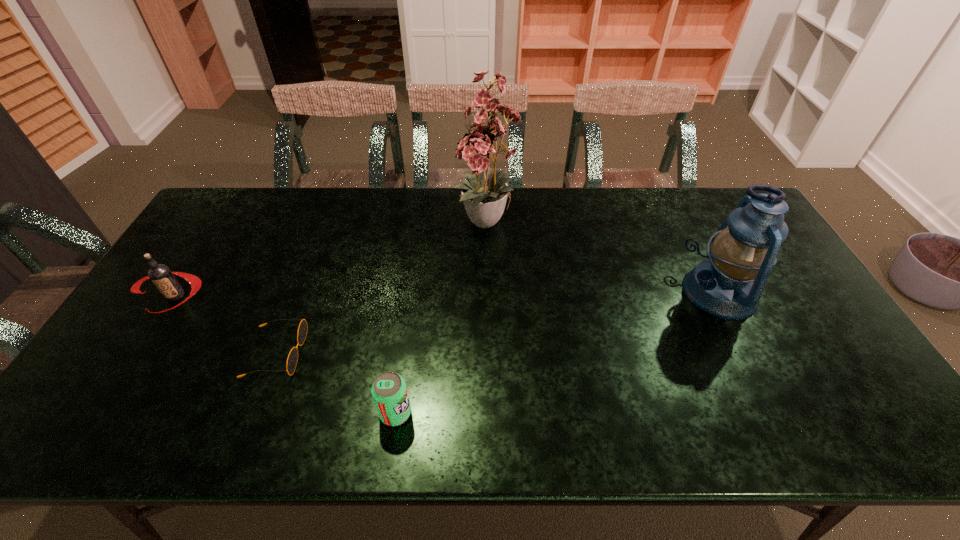
The image size is (960, 540). In order to click on vacant area that satisfies the following two spatial constraints: 1. on the front-facing side of the flower arrangement; 2. on the front-facing side of the third object from left to right in this screenshot , I will do `click(492, 413)`.

Locate an element on the screen. blank area in the image that satisfies the following two spatial constraints: 1. on the front-facing side of the flower arrangement; 2. on the front-facing side of the pop soda is located at coordinates (492, 413).